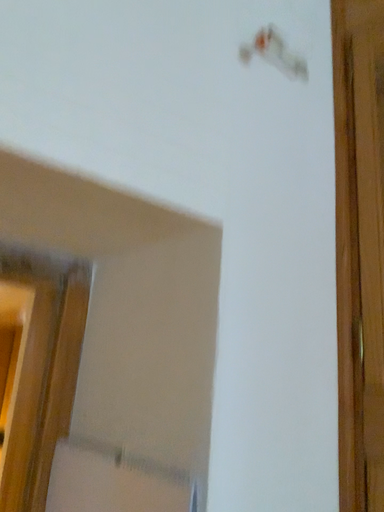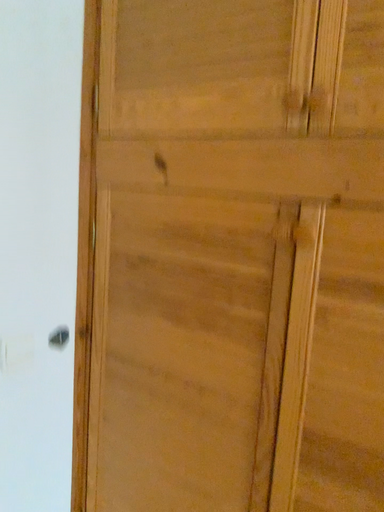
Question: Which way did the camera rotate in the video?

Choices:
 (A) rotated right
 (B) rotated left

Answer: (A)